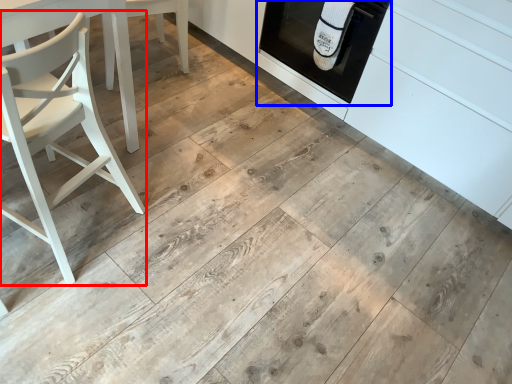
Question: Which of the following is the closest to the observer, chair (highlighted by a red box) or oven (highlighted by a blue box)?

Choices:
 (A) chair
 (B) oven

Answer: (A)